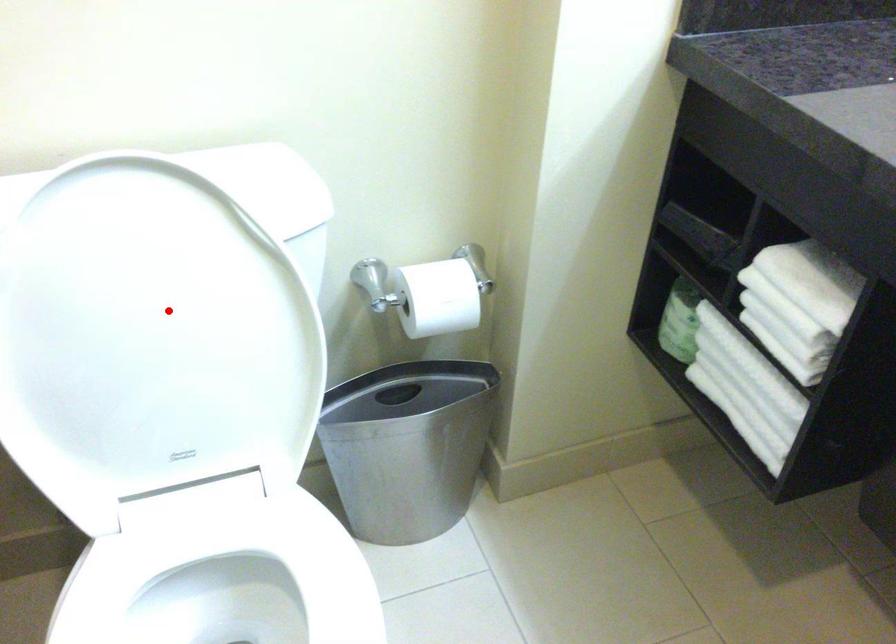
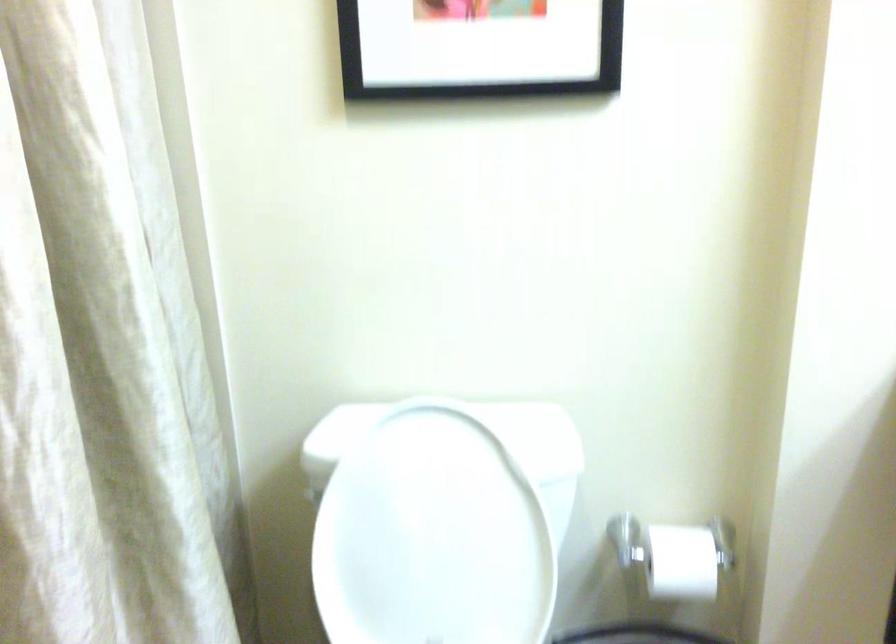
Find the pixel in the second image that matches the highlighted location in the first image.

(440, 520)